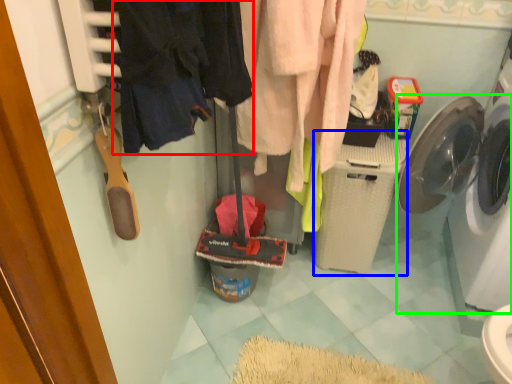
Question: Which object is the farthest from clothing (highlighted by a red box)? Choose among these: washing machine (highlighted by a blue box) or washing machine (highlighted by a green box).

Choices:
 (A) washing machine
 (B) washing machine

Answer: (B)